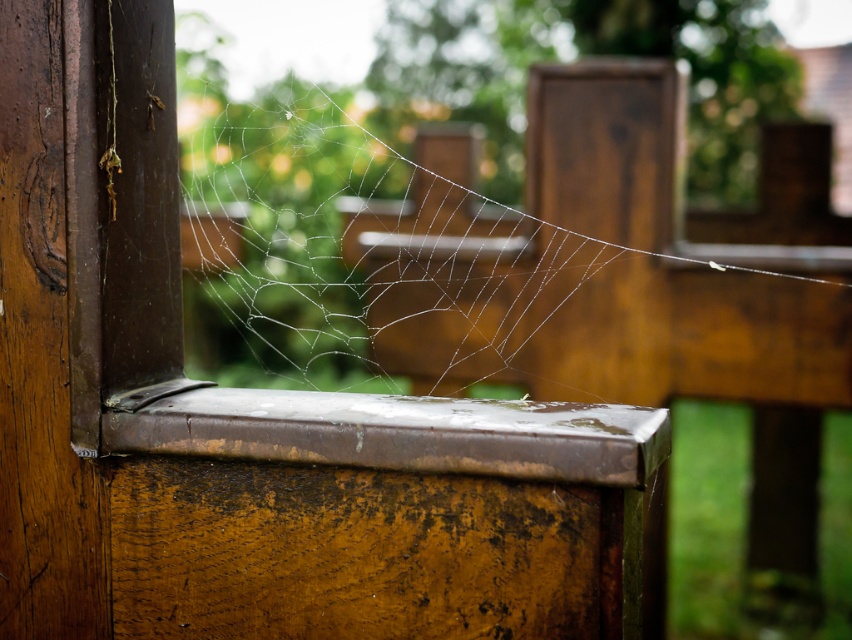
You are a painter assessing the space between the transparent silk spider web at center and the rusty metal window sill at center to paint a decorative border. Can the border fit if it requires a minimum width of 30 cm?

The transparent silk spider web at center is wider than the rusty metal window sill at center. Since the spider web is wider, the space between them can accommodate a border with a minimum width of 30 cm.

You are standing outside looking at the wooden structure. You notice a transparent silk spider web at center and a transparent glass window at left. Which object is closer to the left edge of the wooden structure?

The transparent glass window at left is closer to the left edge of the wooden structure because the transparent silk spider web at center is to the right of it.